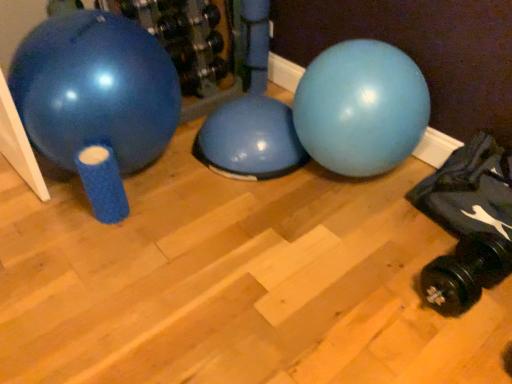
Question: Considering their positions, is black rubber dumbbell at lower right located in front of or behind matte blue exercise ball at left?

Choices:
 (A) behind
 (B) front

Answer: (B)

Question: From the image's perspective, is black rubber dumbbell at lower right positioned above or below matte blue exercise ball at left?

Choices:
 (A) below
 (B) above

Answer: (A)

Question: From a real-world perspective, is black rubber dumbbell at lower right physically located above or below matte blue exercise ball at left?

Choices:
 (A) above
 (B) below

Answer: (B)

Question: Looking at the image, does matte blue exercise ball at left seem bigger or smaller compared to black rubber dumbbell at lower right?

Choices:
 (A) small
 (B) big

Answer: (B)

Question: From their relative heights in the image, would you say matte blue exercise ball at left is taller or shorter than black rubber dumbbell at lower right?

Choices:
 (A) tall
 (B) short

Answer: (A)

Question: From a real-world perspective, is matte blue exercise ball at left positioned above or below black rubber dumbbell at lower right?

Choices:
 (A) above
 (B) below

Answer: (A)

Question: From the image's perspective, is matte blue exercise ball at left above or below black rubber dumbbell at lower right?

Choices:
 (A) above
 (B) below

Answer: (A)